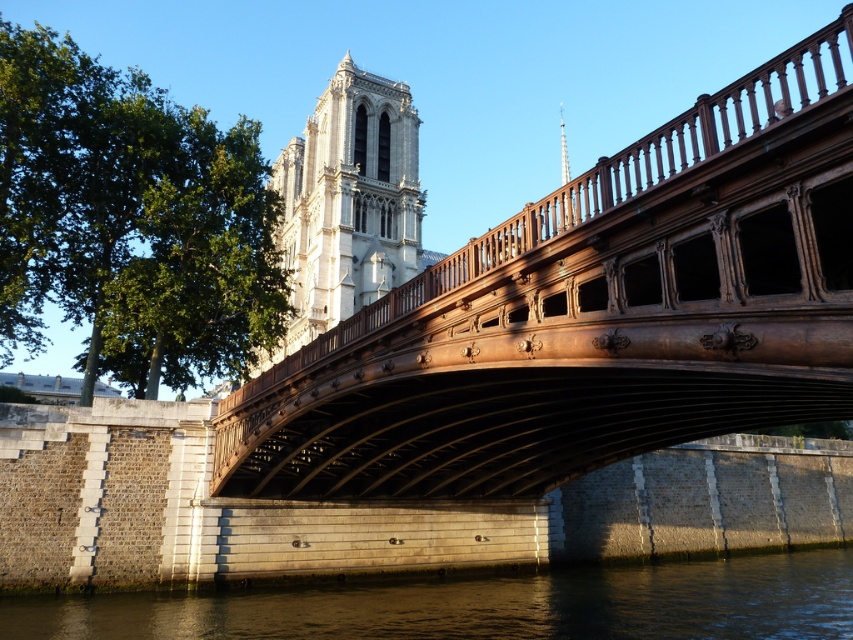
Identify the location of brown polished wood bridge at center. The image size is (853, 640). point(592,316).

Is point (735, 173) positioned behind point (96, 636)?

No.

I want to click on brown polished wood bridge at center, so click(592, 316).

Who is lower down, white stone tower at upper center or smooth silver spire at upper center?

white stone tower at upper center

This screenshot has width=853, height=640. What do you see at coordinates (347, 202) in the screenshot?
I see `white stone tower at upper center` at bounding box center [347, 202].

Identify the location of white stone tower at upper center. The width and height of the screenshot is (853, 640). (347, 202).

Who is taller, brown polished wood bridge at center or smooth silver spire at upper center?

smooth silver spire at upper center

Between point (338, 429) and point (570, 220), which one is positioned behind?

The point (338, 429) is more distant.

Describe the element at coordinates (592, 316) in the screenshot. This screenshot has width=853, height=640. I see `brown polished wood bridge at center` at that location.

Locate an element on the screen. The width and height of the screenshot is (853, 640). brown polished wood bridge at center is located at coordinates (592, 316).